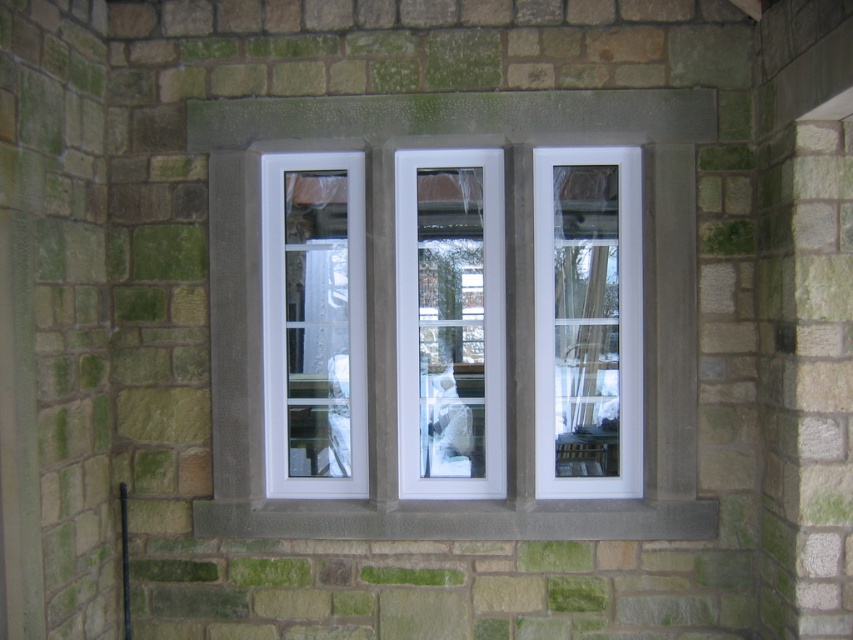
You are standing in front of the stone wall with the white glass door at center and the gray stone window sill at center. Which object is closer to you?

The white glass door at center is closer to you than the gray stone window sill at center.

You are a delivery person trying to enter a building through the white glossy glass door at center. The door is partially blocked by a delivery cart that is 1.2 meters wide. Can you still pass through the door? Please consider the width of the gray stone window sill at center as a reference point.

The white glossy glass door at center has a lesser width compared to the gray stone window sill at center. Since the delivery cart is 1.2 meters wide, if the window sill is wider than 1.2 meters, the door might be narrower than that. Therefore, it is uncertain whether the door is wide enough for the cart to pass through without knowing the exact width of the window sill.